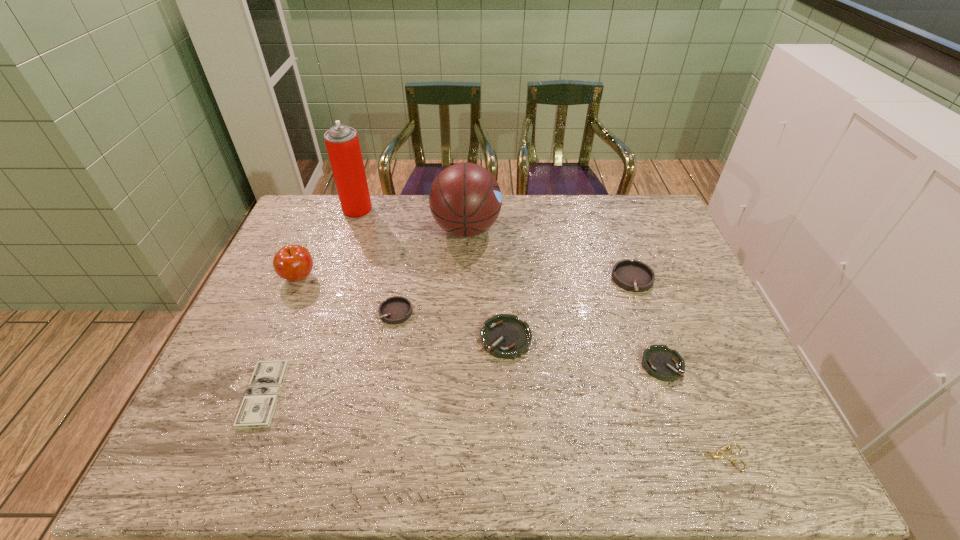
Find the location of a particular element. This screenshot has height=540, width=960. the smaller green ashtray is located at coordinates (659, 361).

Locate an element on the screen. The width and height of the screenshot is (960, 540). the shortest ashtray is located at coordinates (659, 361).

Where is `the eighth tallest object`? Image resolution: width=960 pixels, height=540 pixels. the eighth tallest object is located at coordinates (259, 402).

Find the location of a particular element. The height and width of the screenshot is (540, 960). shears is located at coordinates (718, 455).

The height and width of the screenshot is (540, 960). Find the location of `beige shears`. beige shears is located at coordinates (718, 455).

Locate an element on the screen. free space located 0.290m on the right of the red aerosol can is located at coordinates (453, 210).

The image size is (960, 540). Find the location of `vacant space located on the left of the basketball`. vacant space located on the left of the basketball is located at coordinates (394, 229).

I want to click on free spot located 0.120m on the right of the apple, so click(x=357, y=277).

The image size is (960, 540). I want to click on vacant point located 0.170m on the back of the bigger gray ashtray, so click(x=615, y=231).

Image resolution: width=960 pixels, height=540 pixels. I want to click on vacant space situated on the front of the smaller gray ashtray, so click(x=380, y=400).